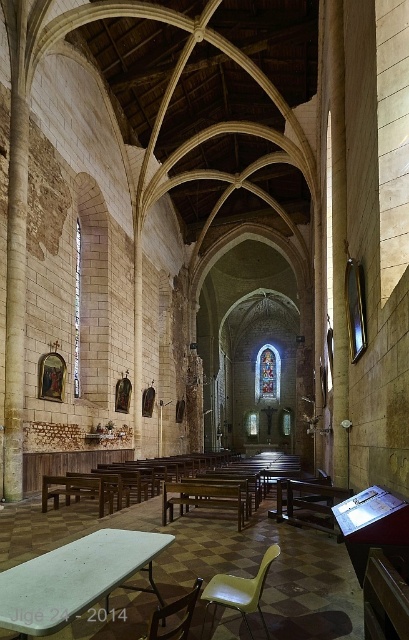
Question: Estimate the real-world distances between objects in this image. Which object is farther from the wooden table at center?

Choices:
 (A) matte beige chair at lower center
 (B) white plastic table at center
 (C) light green plastic chair at lower center

Answer: (A)

Question: Which point appears farthest from the camera in this image?

Choices:
 (A) (145, 540)
 (B) (166, 492)
 (C) (182, 620)

Answer: (B)

Question: Which of these objects is positioned closest to the white plastic table at center?

Choices:
 (A) wooden table at center
 (B) matte beige chair at lower center

Answer: (B)

Question: Can you confirm if white plastic table at center is bigger than light green plastic chair at lower center?

Choices:
 (A) no
 (B) yes

Answer: (B)

Question: Does light green plastic chair at lower center appear over matte beige chair at lower center?

Choices:
 (A) no
 (B) yes

Answer: (A)

Question: Is white plastic table at center smaller than wooden table at center?

Choices:
 (A) no
 (B) yes

Answer: (B)